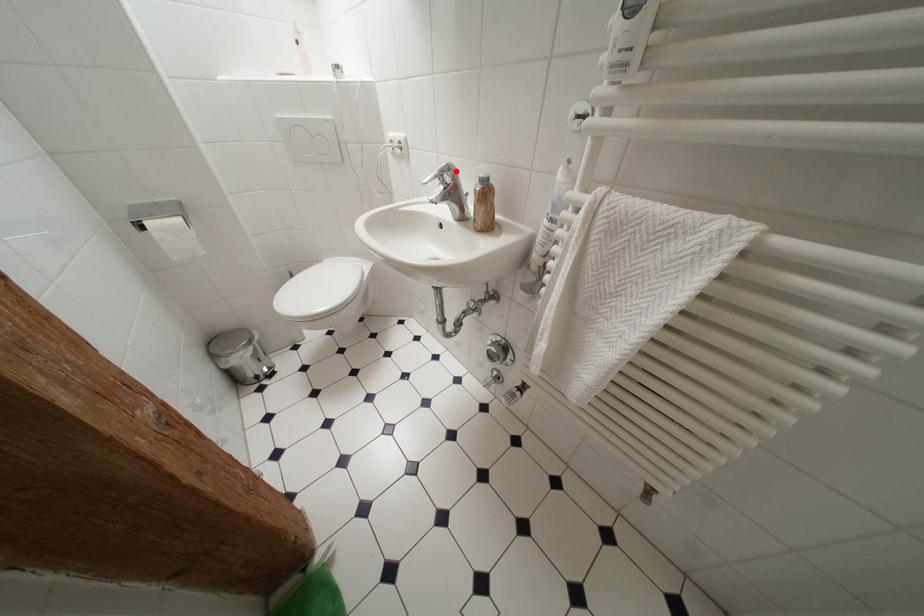
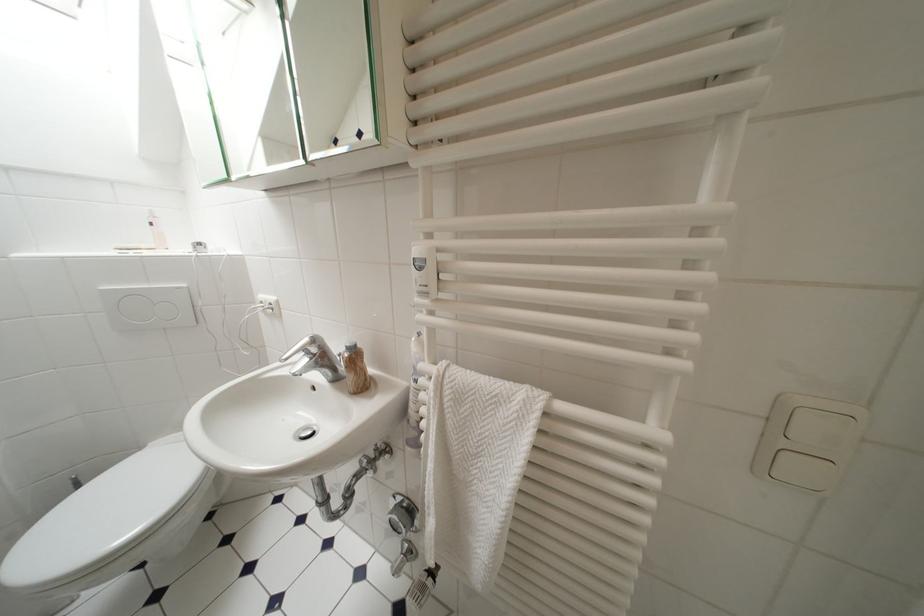
Locate, in the second image, the point that corresponds to the highlighted location in the first image.

(322, 342)